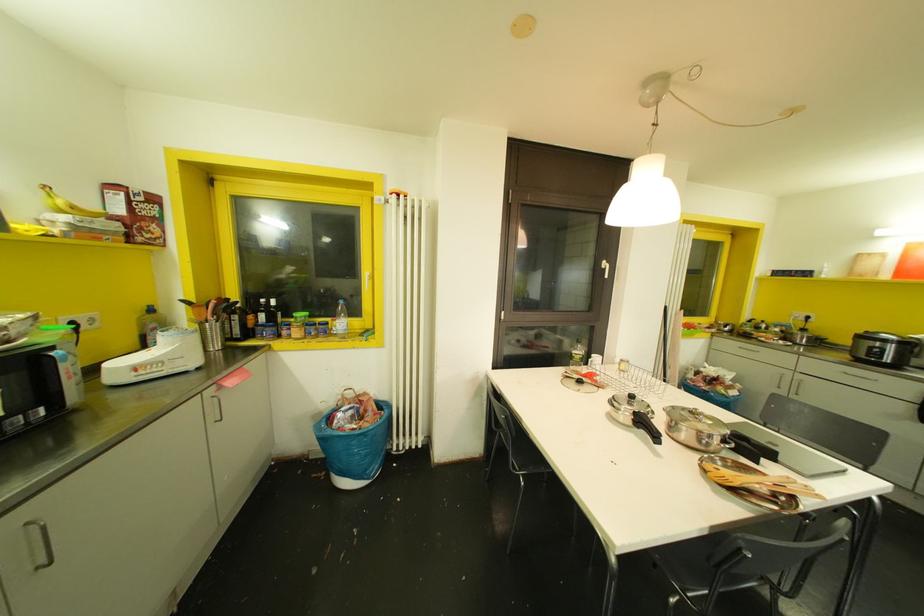
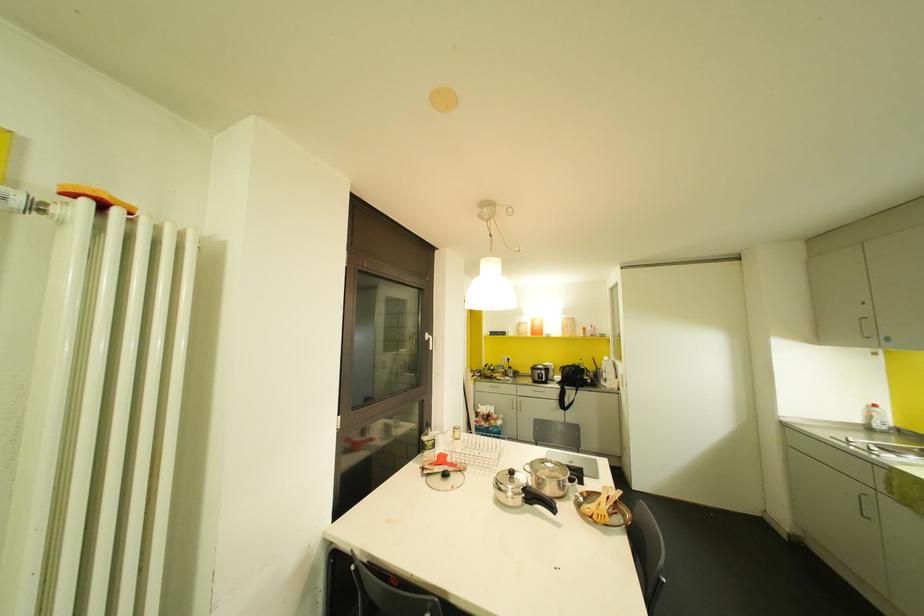
Find the pixel in the second image that matches pixel 577 357 in the first image.

(429, 444)